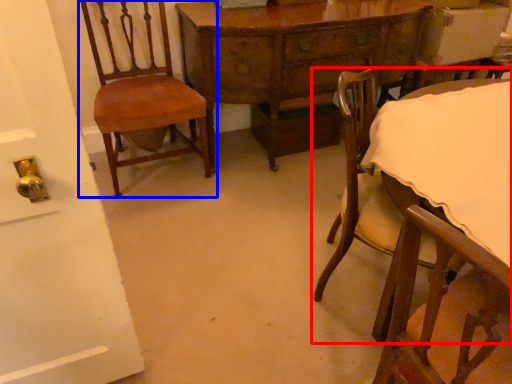
Question: Which object appears farthest to the camera in this image, chair (highlighted by a red box) or chair (highlighted by a blue box)?

Choices:
 (A) chair
 (B) chair

Answer: (B)